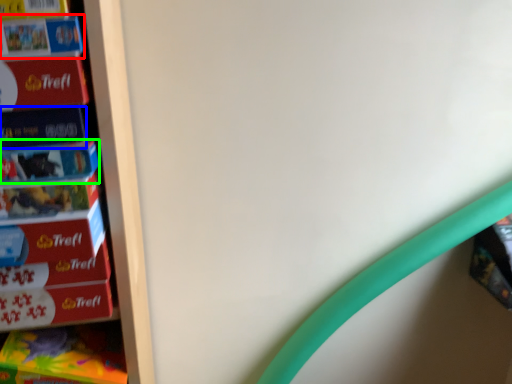
Question: Based on their relative distances, which object is nearer to book (highlighted by a red box)? Choose from paperback book (highlighted by a blue box) and paperback book (highlighted by a green box).

Choices:
 (A) paperback book
 (B) paperback book

Answer: (A)